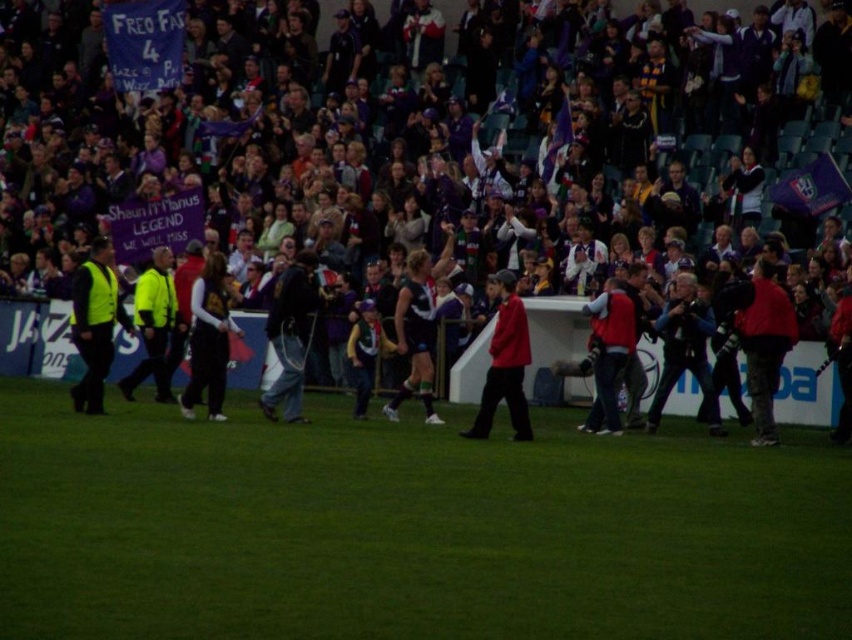
Does white jersey at center appear on the right side of green grass at center?

In fact, white jersey at center is to the left of green grass at center.

Does white jersey at center appear under green grass at center?

No, white jersey at center is not below green grass at center.

In order to click on white jersey at center in this screenshot , I will do `click(407, 161)`.

Does dark gray fabric jacket at center appear on the right side of red matte jacket at center?

Incorrect, dark gray fabric jacket at center is not on the right side of red matte jacket at center.

Does dark gray fabric jacket at center come in front of red matte jacket at center?

No.

Is point (223, 316) positioned behind point (515, 282)?

Yes, it is behind point (515, 282).

I want to click on dark gray fabric jacket at center, so click(208, 339).

Measure the distance between point (x=822, y=536) and camera.

Point (x=822, y=536) is 13.68 meters from camera.

Is green grass at center smaller than dark gray fabric jacket at center?

No, green grass at center is not smaller than dark gray fabric jacket at center.

Is point (796, 604) farther from camera compared to point (222, 403)?

No, it is not.

Locate an element on the screen. green grass at center is located at coordinates (409, 529).